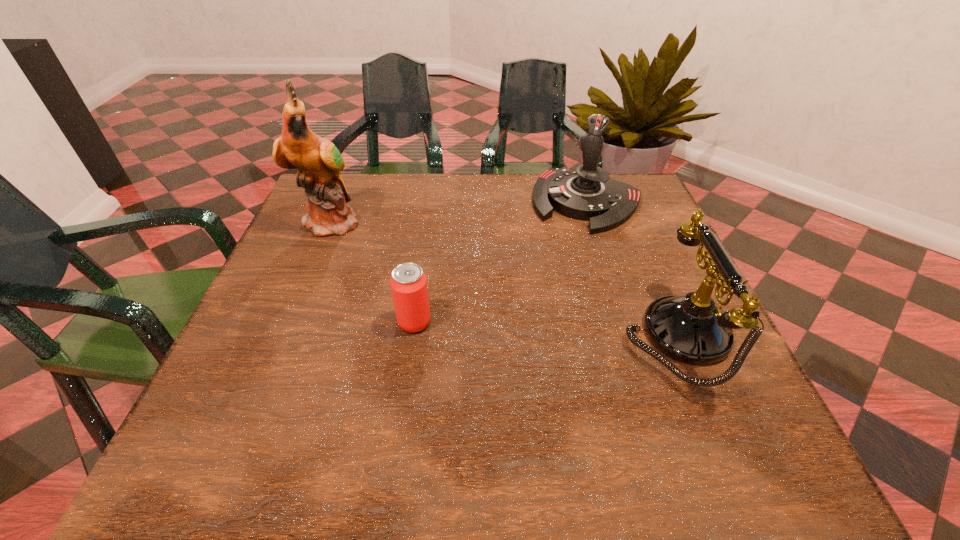
I want to click on free space between the telephone and the second object from left to right, so tap(545, 329).

Where is `free spot between the telephone and the tallest object`? free spot between the telephone and the tallest object is located at coordinates (504, 278).

Locate an element on the screen. This screenshot has width=960, height=540. free space between the tallest object and the telephone is located at coordinates (504, 278).

The height and width of the screenshot is (540, 960). I want to click on empty space that is in between the joystick and the beer can, so click(501, 262).

Image resolution: width=960 pixels, height=540 pixels. Find the location of `free space between the shortest object and the tallest object`. free space between the shortest object and the tallest object is located at coordinates (373, 271).

Where is `unoccupied position between the tallest object and the telephone`? The width and height of the screenshot is (960, 540). unoccupied position between the tallest object and the telephone is located at coordinates (504, 278).

The width and height of the screenshot is (960, 540). I want to click on free spot between the telephone and the parrot, so click(504, 278).

Identify the location of the closest object to the second object from left to right. (319, 161).

The width and height of the screenshot is (960, 540). Find the location of `object that is the third closest to the telephone`. object that is the third closest to the telephone is located at coordinates (319, 161).